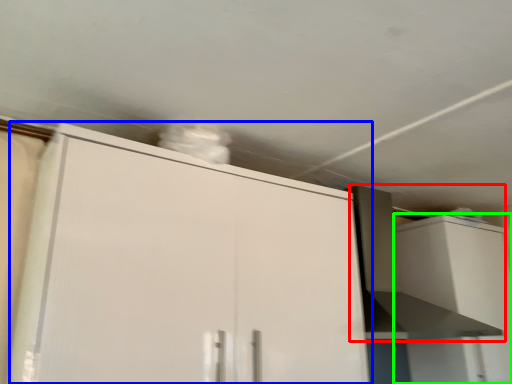
Question: Which object is positioned closest to vent (highlighted by a red box)? Select from cabinetry (highlighted by a blue box) and cabinetry (highlighted by a green box).

Choices:
 (A) cabinetry
 (B) cabinetry

Answer: (B)